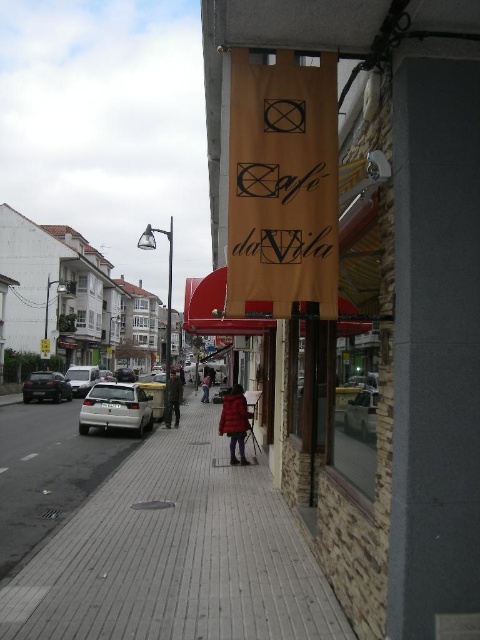
You are a delivery person standing on the smooth concrete pavement at center and need to hand a package to the person wearing the dark brown leather jacket at center. Can you reach them without moving from your current position?

The smooth concrete pavement at center is closer to the viewer than the dark brown leather jacket at center, so you cannot reach them without moving closer.

Looking at this image, you are a delivery person standing on the sidewalk near the entrance of the building. You need to hand a package to the person in the matte red coat at center. However, there is an orange fabric sign at upper center in the way. Can you reach the person without moving the sign?

The orange fabric sign at upper center is positioned over the matte red coat at center, so you can still reach the person by approaching from the sides or below the sign since the sign is above them.